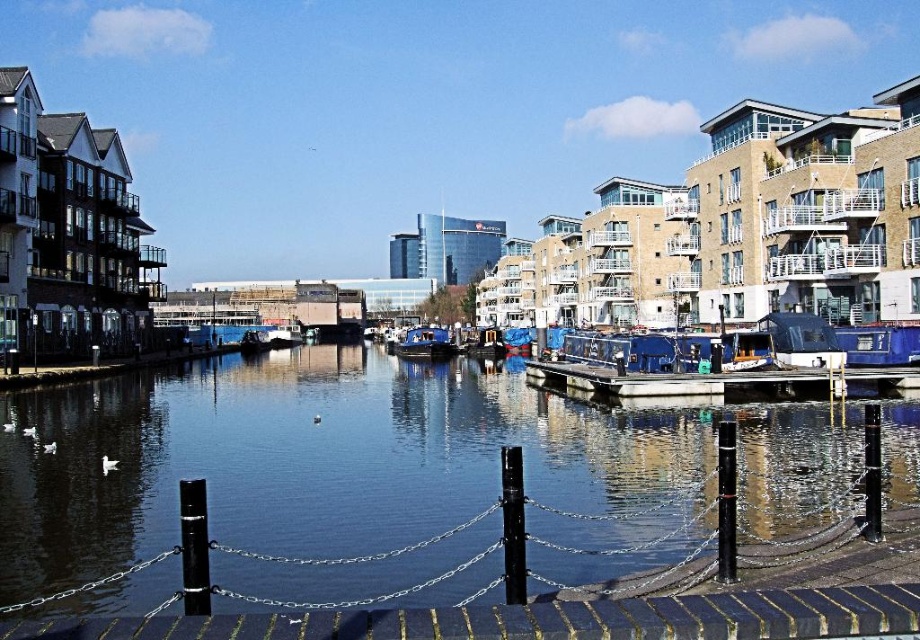
Question: Which object appears farthest from the camera in this image?

Choices:
 (A) dark blue water at center
 (B) blue tarpaulin boat at center

Answer: (B)

Question: Estimate the real-world distances between objects in this image. Which object is closer to the blue matte boat at center?

Choices:
 (A) blue tarpaulin boat at center
 (B) dark blue water at center
 (C) blue painted wood dock at center

Answer: (A)

Question: Can you confirm if dark blue water at center is positioned above blue painted wood dock at center?

Choices:
 (A) yes
 (B) no

Answer: (B)

Question: Is dark blue water at center closer to the viewer compared to blue painted wood dock at center?

Choices:
 (A) no
 (B) yes

Answer: (B)

Question: Which of these objects is positioned farthest from the blue painted wood dock at center?

Choices:
 (A) dark blue water at center
 (B) blue tarpaulin boat at center
 (C) blue matte boat at center

Answer: (C)

Question: Is dark blue water at center wider than blue matte boat at center?

Choices:
 (A) no
 (B) yes

Answer: (B)